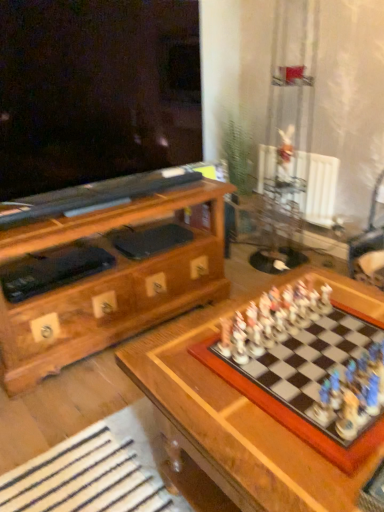
Question: Is wooden chessboard at center situated inside metallic silver swivel chair at right or outside?

Choices:
 (A) inside
 (B) outside

Answer: (B)

Question: Is wooden chessboard at center bigger or smaller than metallic silver swivel chair at right?

Choices:
 (A) big
 (B) small

Answer: (A)

Question: Which object is the farthest from the white plastic radiator at upper right?

Choices:
 (A) metallic silver swivel chair at right
 (B) wooden chessboard at center

Answer: (B)

Question: Which object is the closest to the metallic silver swivel chair at right?

Choices:
 (A) wooden chessboard at center
 (B) white plastic radiator at upper right

Answer: (B)